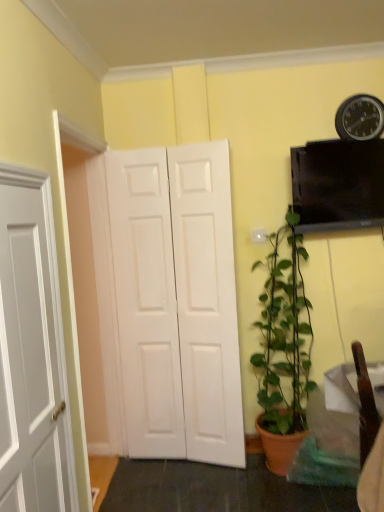
What do you see at coordinates (177, 302) in the screenshot? I see `white matte door at center` at bounding box center [177, 302].

The image size is (384, 512). What are the coordinates of `green matte plant at lower right` in the screenshot? It's located at (283, 350).

I want to click on white matte door at center, so click(177, 302).

Can you confirm if metallic black clock at upper right is shorter than white matte door at center?

Correct, metallic black clock at upper right is not as tall as white matte door at center.

Considering the positions of points (360, 113) and (194, 183), is point (360, 113) closer to camera compared to point (194, 183)?

Yes.

In the image, is metallic black clock at upper right on the left side or the right side of white matte door at center?

metallic black clock at upper right is positioned on white matte door at center's right side.

Is metallic black clock at upper right positioned with its back to white matte door at center?

No, metallic black clock at upper right's orientation is not away from white matte door at center.

Is white matte door at center with metallic black clock at upper right?

There is a gap between white matte door at center and metallic black clock at upper right.

From a real-world perspective, is white matte door at center on metallic black clock at upper right?

Incorrect, from a real-world perspective, white matte door at center is lower than metallic black clock at upper right.

Between white matte door at center and metallic black clock at upper right, which one has larger width?

With larger width is white matte door at center.

Who is smaller, white matte door at center or metallic black clock at upper right?

metallic black clock at upper right.

Which object is further away from the camera, white matte door at center or green matte plant at lower right?

white matte door at center.

Which object is wider, white matte door at center or green matte plant at lower right?

With larger width is green matte plant at lower right.

This screenshot has height=512, width=384. Find the location of `door that appears above the green matte plant at lower right (from the image's perspective)`. door that appears above the green matte plant at lower right (from the image's perspective) is located at coordinates (x=177, y=302).

How many degrees apart are the facing directions of white matte door at center and green matte plant at lower right?

5.81 degrees separate the facing orientations of white matte door at center and green matte plant at lower right.

From the image's perspective, which one is positioned lower, green matte plant at lower right or white matte door at center?

From the image's view, green matte plant at lower right is below.

Considering the points (272, 402) and (124, 189), which point is behind, point (272, 402) or point (124, 189)?

The point (272, 402) is more distant.

Between green matte plant at lower right and white matte door at center, which one has larger size?

green matte plant at lower right is bigger.

Can you tell me how much metallic black clock at upper right and green matte plant at lower right differ in facing direction?

metallic black clock at upper right and green matte plant at lower right are facing 0.455 degrees away from each other.

Where is `houseplant below the metallic black clock at upper right (from the image's perspective)`? The image size is (384, 512). houseplant below the metallic black clock at upper right (from the image's perspective) is located at coordinates (283, 350).

Consider the image. Considering the relative sizes of metallic black clock at upper right and green matte plant at lower right in the image provided, is metallic black clock at upper right smaller than green matte plant at lower right?

Yes.

Considering the relative sizes of green matte plant at lower right and metallic black clock at upper right in the image provided, is green matte plant at lower right thinner than metallic black clock at upper right?

No.

How distant is green matte plant at lower right from metallic black clock at upper right?

green matte plant at lower right and metallic black clock at upper right are 1.02 meters apart.

From a real-world perspective, relative to metallic black clock at upper right, is green matte plant at lower right vertically above or below?

green matte plant at lower right is situated lower than metallic black clock at upper right in the real world.

Is the surface of green matte plant at lower right in direct contact with metallic black clock at upper right?

No, green matte plant at lower right is not touching metallic black clock at upper right.

Locate an element on the screen. The height and width of the screenshot is (512, 384). door that is below the metallic black clock at upper right (from the image's perspective) is located at coordinates [177, 302].

Identify the location of door lying on the left of metallic black clock at upper right. This screenshot has width=384, height=512. (177, 302).

Considering their positions, is green matte plant at lower right positioned closer to white matte door at center than metallic black clock at upper right?

The object closer to white matte door at center is green matte plant at lower right.

From the image, which object appears to be nearer to white matte door at center, metallic black clock at upper right or green matte plant at lower right?

green matte plant at lower right is closer to white matte door at center.

From the image, which object appears to be nearer to metallic black clock at upper right, green matte plant at lower right or white matte door at center?

Among the two, green matte plant at lower right is located nearer to metallic black clock at upper right.

Looking at the image, which one is located closer to metallic black clock at upper right, white matte door at center or green matte plant at lower right?

Among the two, green matte plant at lower right is located nearer to metallic black clock at upper right.

Based on their spatial positions, is metallic black clock at upper right or white matte door at center closer to green matte plant at lower right?

white matte door at center is positioned closer to the anchor green matte plant at lower right.

Which object lies further to the anchor point green matte plant at lower right, white matte door at center or metallic black clock at upper right?

metallic black clock at upper right.

Where is `door between metallic black clock at upper right and green matte plant at lower right from top to bottom`? The height and width of the screenshot is (512, 384). door between metallic black clock at upper right and green matte plant at lower right from top to bottom is located at coordinates (177, 302).